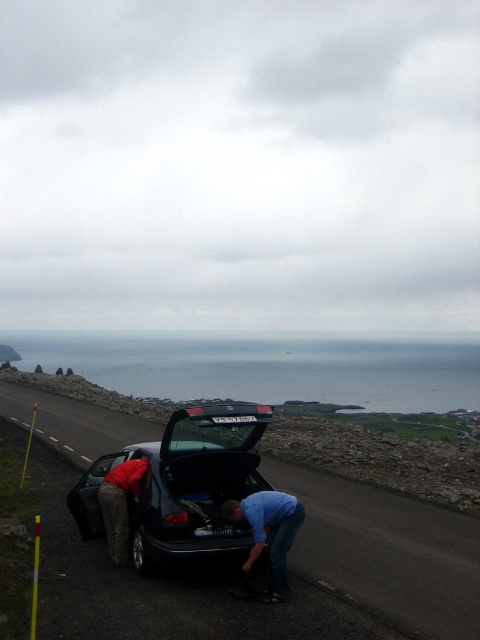
Can you confirm if black matte car at center is positioned below blue denim jeans at lower center?

No, black matte car at center is not below blue denim jeans at lower center.

Is black matte car at center smaller than blue denim jeans at lower center?

Correct, black matte car at center occupies less space than blue denim jeans at lower center.

Which is behind, point (183, 515) or point (266, 544)?

The point (183, 515) is more distant.

Locate an element on the screen. This screenshot has width=480, height=640. black matte car at center is located at coordinates (183, 484).

Which of these two, black matte car at center or camouflage pants at lower left, stands shorter?

black matte car at center

Is black matte car at center smaller than camouflage pants at lower left?

Correct, black matte car at center occupies less space than camouflage pants at lower left.

The width and height of the screenshot is (480, 640). Find the location of `black matte car at center`. black matte car at center is located at coordinates (183, 484).

This screenshot has width=480, height=640. I want to click on black matte car at center, so click(x=183, y=484).

Is the position of blue denim jeans at lower center less distant than that of camouflage pants at lower left?

Yes, it is.

Where is `blue denim jeans at lower center`? The width and height of the screenshot is (480, 640). blue denim jeans at lower center is located at coordinates pyautogui.click(x=268, y=534).